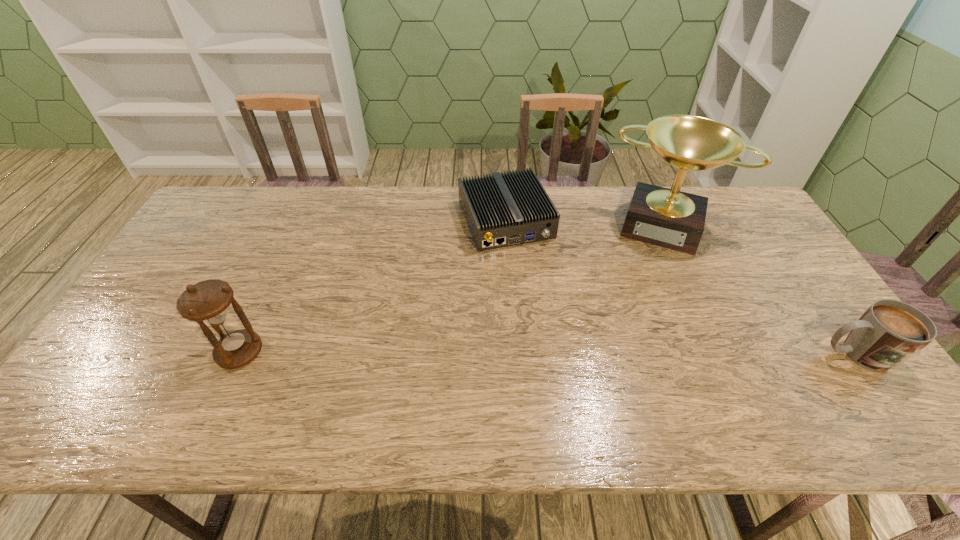
This screenshot has height=540, width=960. I want to click on the second closest object to the leftmost object, so click(669, 218).

The height and width of the screenshot is (540, 960). I want to click on the second closest object to the third shortest object, so click(669, 218).

Identify the location of vacant space that satisfies the following two spatial constraints: 1. on the front side of the tallest object; 2. on the side of the rightmost object with the handle. Image resolution: width=960 pixels, height=540 pixels. (728, 354).

At what (x,y) coordinates should I click in order to perform the action: click on vacant area that satisfies the following two spatial constraints: 1. on the front side of the rightmost object; 2. on the side of the hourglass with the handle. Please return your answer as a coordinate pair (x, y). Image resolution: width=960 pixels, height=540 pixels. Looking at the image, I should click on (239, 354).

Identify the location of blank space that satisfies the following two spatial constraints: 1. on the front side of the second shortest object; 2. on the side of the second object from right to left with the handle. (728, 354).

At what (x,y) coordinates should I click in order to perform the action: click on free space that satisfies the following two spatial constraints: 1. on the back side of the award; 2. on the left side of the second tallest object. Please return your answer as a coordinate pair (x, y). Looking at the image, I should click on (298, 224).

You are a GUI agent. You are given a task and a screenshot of the screen. Output one action in this format:
    pyautogui.click(x=<x>, y=<y>)
    Task: Click on the vacant region that satisfies the following two spatial constraints: 1. on the back side of the third object from right to left; 2. on the right side of the hourglass
    
    Given the screenshot: What is the action you would take?
    pyautogui.click(x=300, y=220)

Find the location of `vacant space that satisfies the following two spatial constraints: 1. on the front side of the second object from left to right; 2. on the side of the rightmost object with the handle`. vacant space that satisfies the following two spatial constraints: 1. on the front side of the second object from left to right; 2. on the side of the rightmost object with the handle is located at coordinates (515, 354).

Locate an element on the screen. free space that satisfies the following two spatial constraints: 1. on the back side of the second tallest object; 2. on the left side of the third object from left to right is located at coordinates (298, 224).